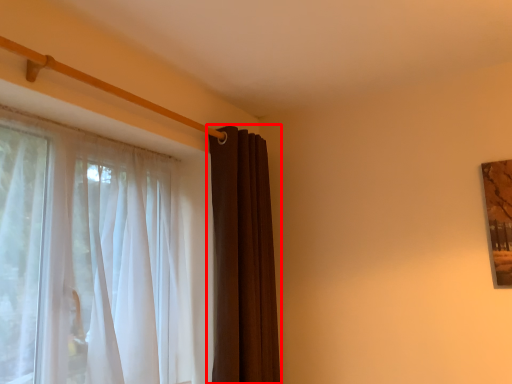
Question: From the image, what is the correct spatial relationship of curtain (annotated by the red box) in relation to curtain?

Choices:
 (A) left
 (B) right

Answer: (B)